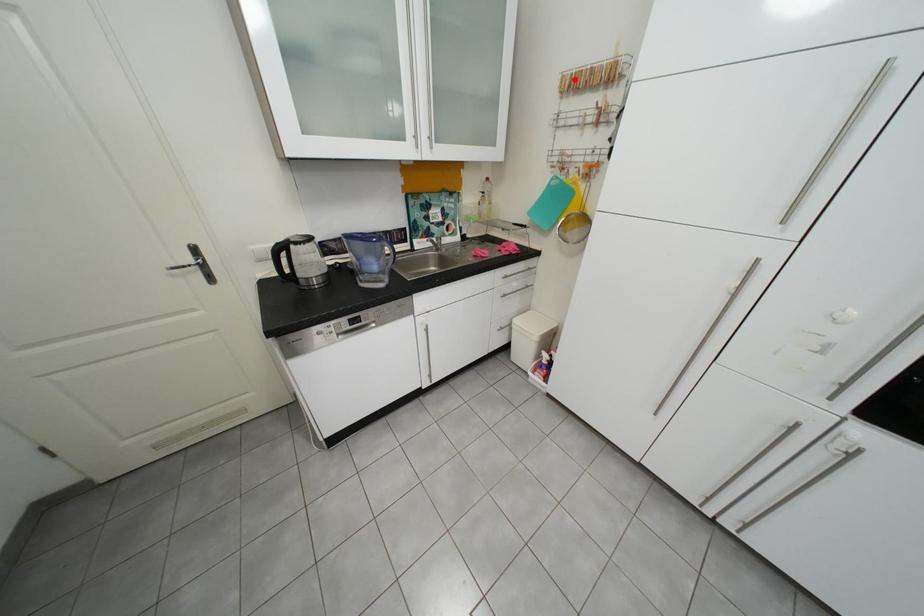
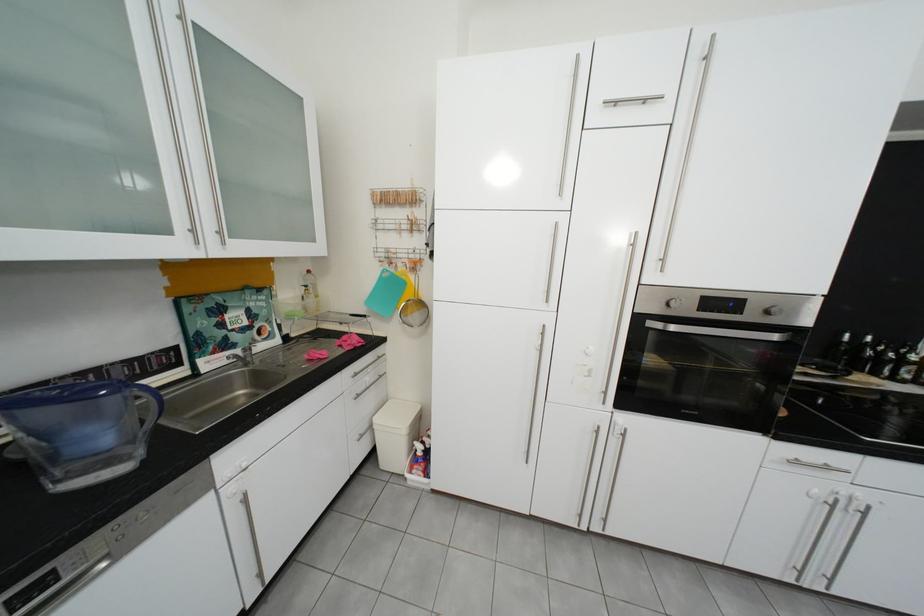
Where in the second image is the point corresponding to the highlighted location from the first image?

(385, 195)